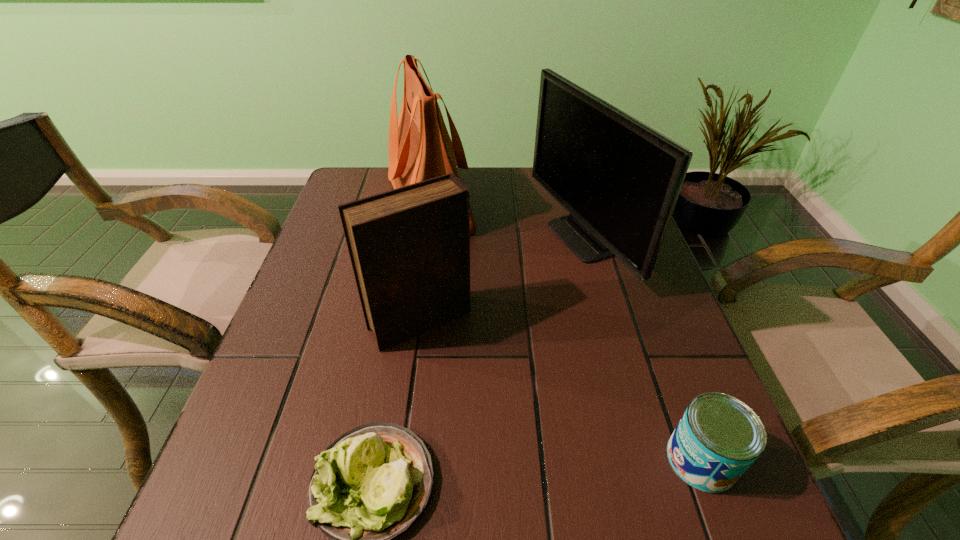
You are a GUI agent. You are given a task and a screenshot of the screen. Output one action in this format:
    pyautogui.click(x=<x>, y=<y>)
    Task: Click on the shopping bag
    This screenshot has width=960, height=540.
    Given the screenshot: What is the action you would take?
    pyautogui.click(x=420, y=148)

Locate an element on the screen. This screenshot has width=960, height=540. computer monitor is located at coordinates (620, 179).

Locate an element on the screen. The image size is (960, 540). Bible is located at coordinates (409, 247).

Find the location of a particular element. This screenshot has width=960, height=540. can is located at coordinates (718, 438).

You are a GUI agent. You are given a task and a screenshot of the screen. Output one action in this format:
    pyautogui.click(x=<x>, y=<y>)
    Task: Click on the blank space located on the front of the shopping bag
    
    Given the screenshot: What is the action you would take?
    pyautogui.click(x=414, y=305)

Image resolution: width=960 pixels, height=540 pixels. Identify the location of vacant space located 0.390m on the front-facing side of the computer monitor. (383, 239).

You are a GUI agent. You are given a task and a screenshot of the screen. Output one action in this format:
    pyautogui.click(x=<x>, y=<y>)
    Task: Click on the vacant space located 0.110m on the front-facing side of the computer monitor
    
    Given the screenshot: What is the action you would take?
    pyautogui.click(x=493, y=239)

Identify the location of free space located on the front-facing side of the computer monitor. This screenshot has width=960, height=540. (446, 239).

Find the location of `vacant area located 0.220m on the right of the third tallest object`. vacant area located 0.220m on the right of the third tallest object is located at coordinates (578, 321).

I want to click on blank space located on the left of the fourth tallest object, so click(580, 460).